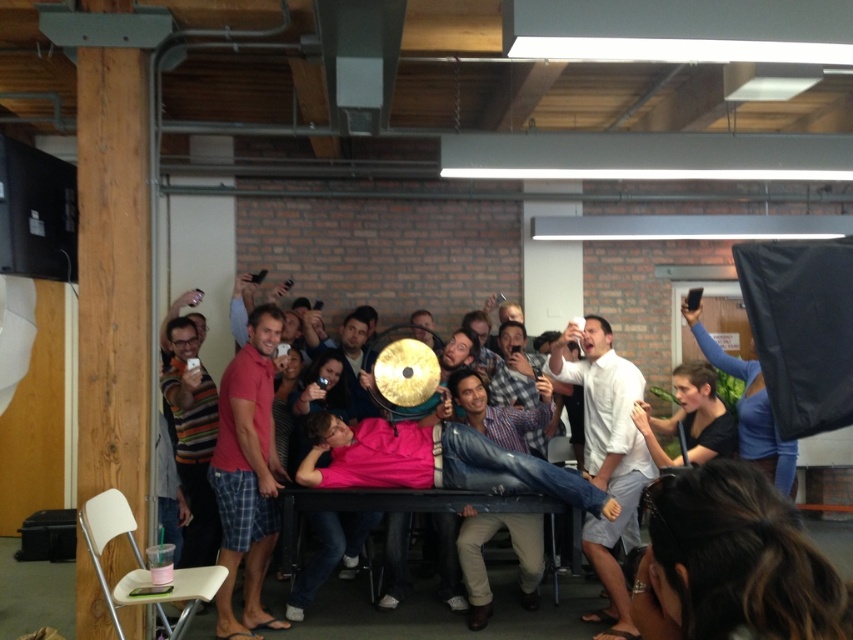
You are taking a photo of the scene and want to focus on both point (276, 321) and point (711, 392). Which point should you adjust your focus to first to ensure both are in clear view?

Point (276, 321) is closer to the camera than point (711, 392). To ensure both are in focus, you should adjust your focus to the closer point first, which is point (276, 321).

You are organizing a photo shoot and need to arrange two shirts on a mannequin. The white matte shirt at center and the smooth black shirt at center must be placed vertically. Which shirt should you place on top to ensure the arrangement is stable?

The white matte shirt at center has a greater height compared to the smooth black shirt at center, so placing the taller white matte shirt at center on the bottom and the shorter smooth black shirt at center on top will create a stable arrangement.

You are a photographer at the event and need to capture a photo where both the white matte shirt at center and the smooth black shirt at center are visible. Based on their positions, which shirt should be placed on the left side of the photo to match the scene?

The white matte shirt at center is positioned on the left side of smooth black shirt at center, so to match the scene, the white matte shirt at center should be placed on the left side of the photo.